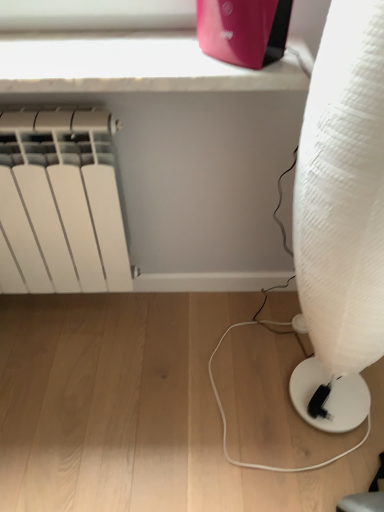
Question: From a real-world perspective, is white textured lamp at right positioned under white matte radiator at left based on gravity?

Choices:
 (A) yes
 (B) no

Answer: (B)

Question: Is white textured lamp at right to the left of white matte radiator at left from the viewer's perspective?

Choices:
 (A) no
 (B) yes

Answer: (A)

Question: Is white matte radiator at left surrounded by white textured lamp at right?

Choices:
 (A) no
 (B) yes

Answer: (A)

Question: Would you say white textured lamp at right is a long distance from white matte radiator at left?

Choices:
 (A) no
 (B) yes

Answer: (A)

Question: Is white textured lamp at right closer to camera compared to white matte radiator at left?

Choices:
 (A) no
 (B) yes

Answer: (B)

Question: Is white textured lamp at right smaller than white matte radiator at left?

Choices:
 (A) yes
 (B) no

Answer: (B)

Question: Can you confirm if white matte radiator at left is taller than white textured lamp at right?

Choices:
 (A) no
 (B) yes

Answer: (A)

Question: Is white matte radiator at left positioned beyond the bounds of white textured lamp at right?

Choices:
 (A) no
 (B) yes

Answer: (B)

Question: Is white matte radiator at left at the right side of white textured lamp at right?

Choices:
 (A) no
 (B) yes

Answer: (A)

Question: From the image's perspective, does white matte radiator at left appear higher than white textured lamp at right?

Choices:
 (A) no
 (B) yes

Answer: (B)

Question: Is white matte radiator at left directly adjacent to white textured lamp at right?

Choices:
 (A) yes
 (B) no

Answer: (B)

Question: Is white matte radiator at left in front of white textured lamp at right?

Choices:
 (A) yes
 (B) no

Answer: (B)

Question: From a real-world perspective, is matte pink router at upper center positioned over white matte radiator at left based on gravity?

Choices:
 (A) no
 (B) yes

Answer: (B)